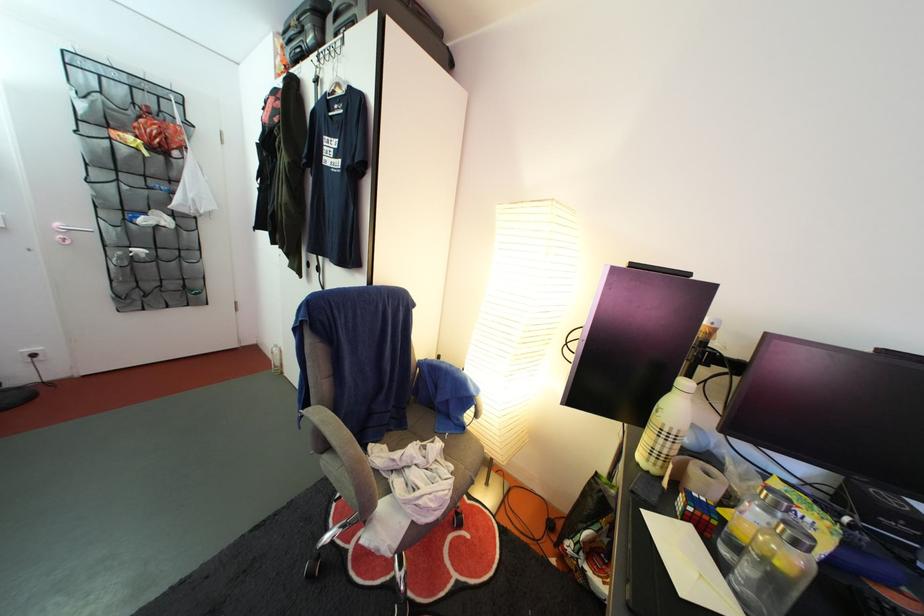
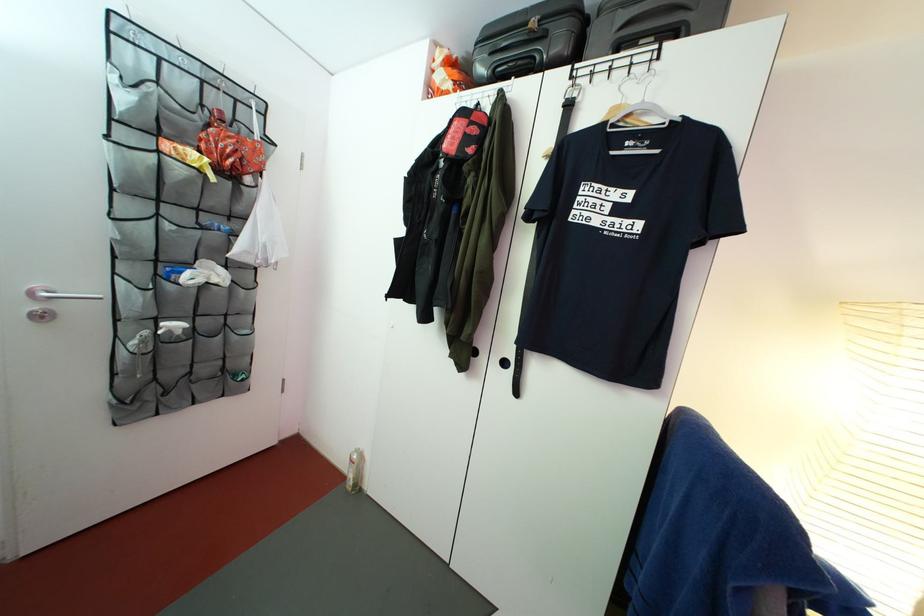
In a continuous first-person perspective shot, in which direction is the camera moving?

The cameraman walked toward left, forward.